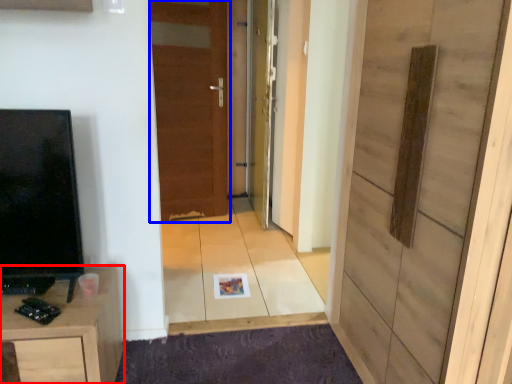
Question: Which of the following is the closest to the observer, cabinetry (highlighted by a red box) or door (highlighted by a blue box)?

Choices:
 (A) cabinetry
 (B) door

Answer: (A)